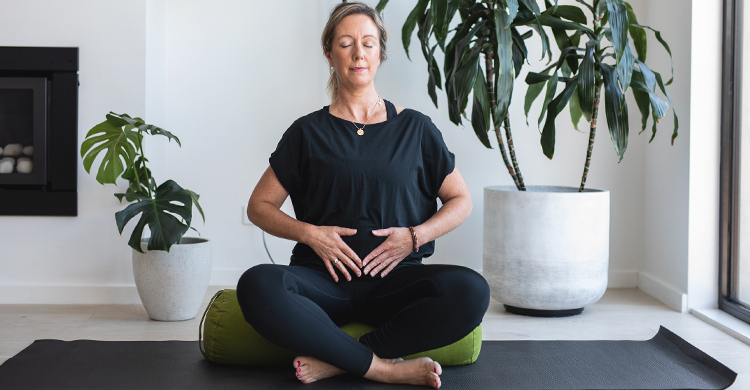
Identify the location of pots. Image resolution: width=750 pixels, height=390 pixels. (537, 258), (151, 281).